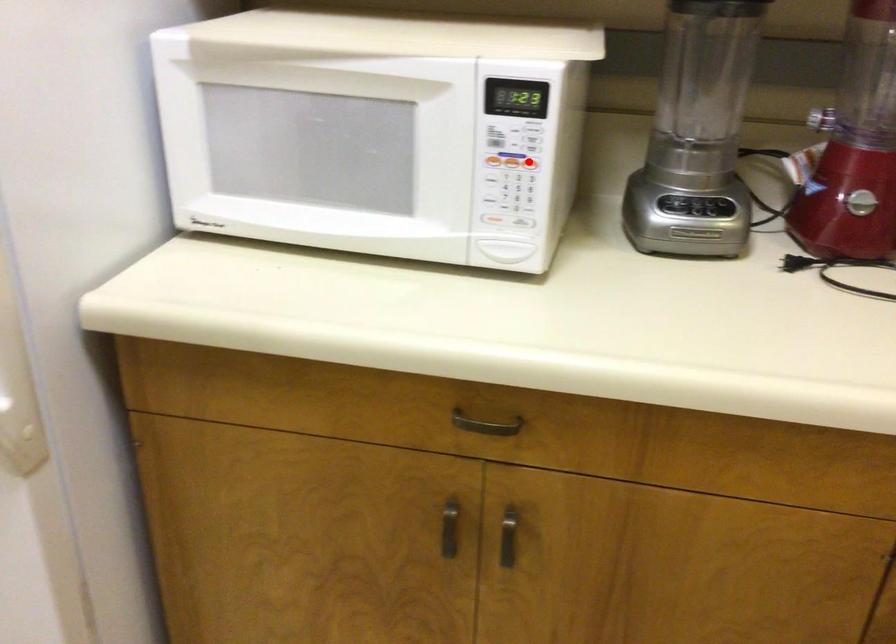
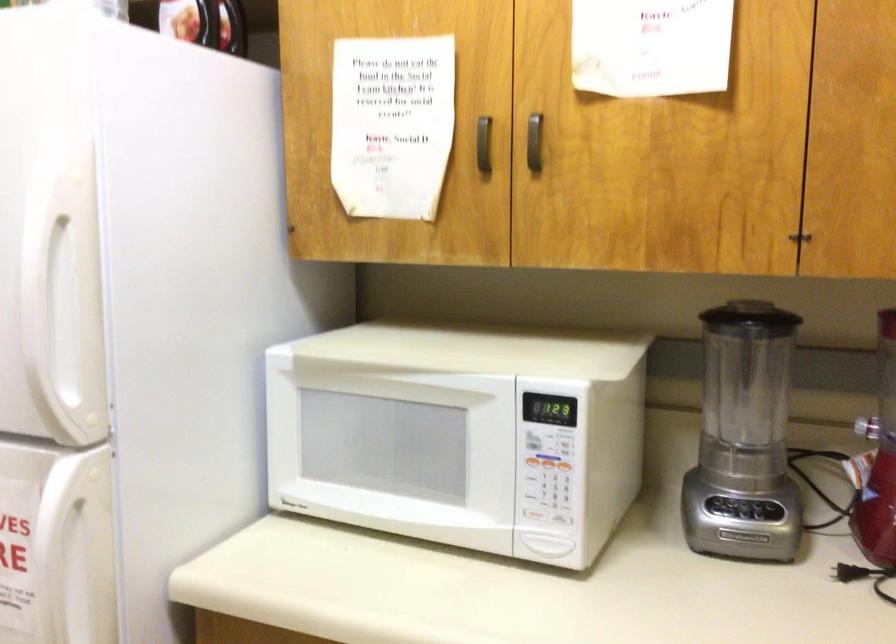
In the second image, find the point that corresponds to the highlighted location in the first image.

(565, 467)